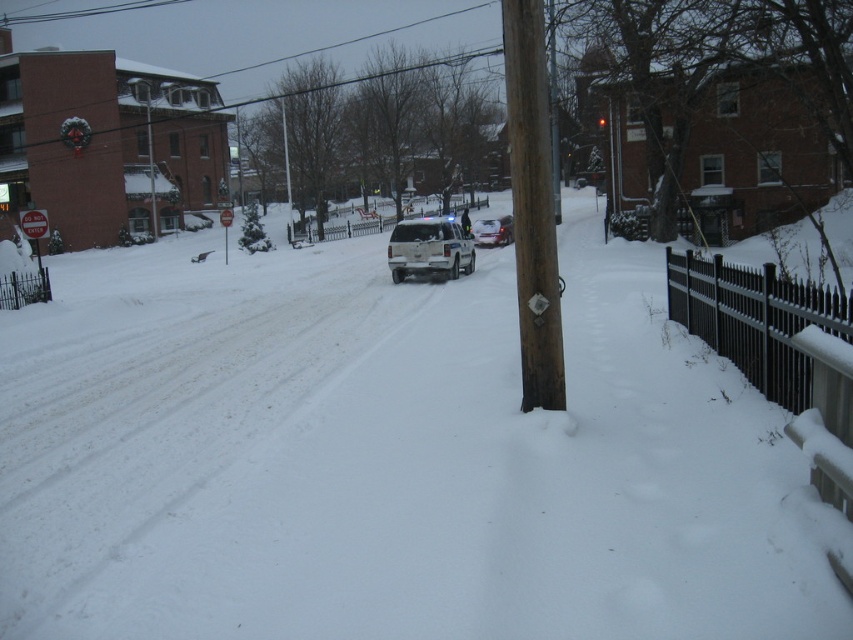
Question: Which object is closer to the camera taking this photo?

Choices:
 (A) metallic silver sign at left
 (B) satin silver suv at center
 (C) silver metallic sedan at center
 (D) brown wooden pole at center

Answer: (D)

Question: Which object is the farthest from the white fluffy snow at center?

Choices:
 (A) brown wooden pole at center
 (B) red plastic stop sign at center
 (C) satin silver suv at center
 (D) metallic silver sign at left

Answer: (B)

Question: Which point is farther to the camera?

Choices:
 (A) satin silver suv at center
 (B) white fluffy snow at center
 (C) red plastic stop sign at center

Answer: (C)

Question: In this image, where is metallic silver sign at left located relative to red plastic stop sign at center?

Choices:
 (A) above
 (B) below

Answer: (B)

Question: Does white fluffy snow at center lie behind metallic silver sign at left?

Choices:
 (A) yes
 (B) no

Answer: (B)

Question: Does brown wooden pole at center have a lesser width compared to red plastic stop sign at center?

Choices:
 (A) yes
 (B) no

Answer: (A)